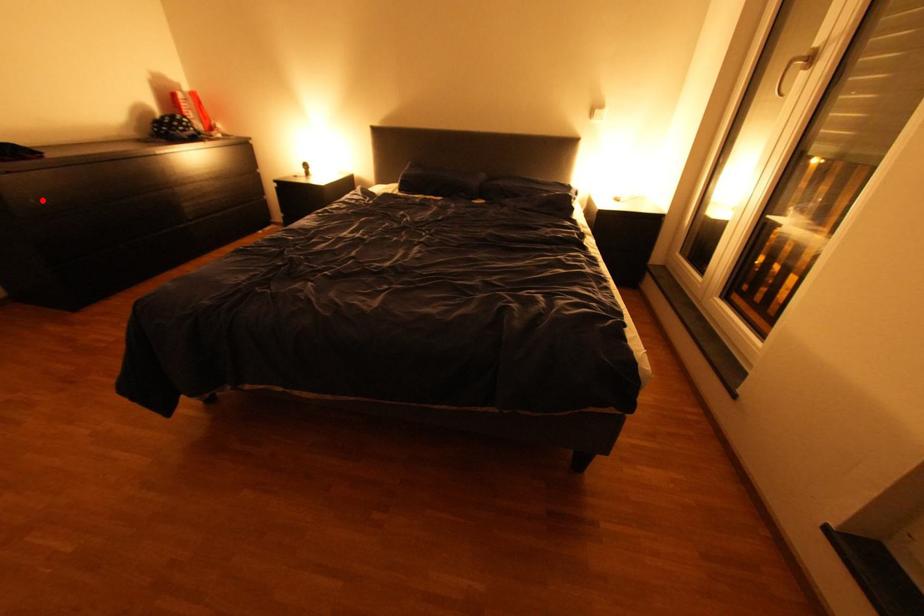
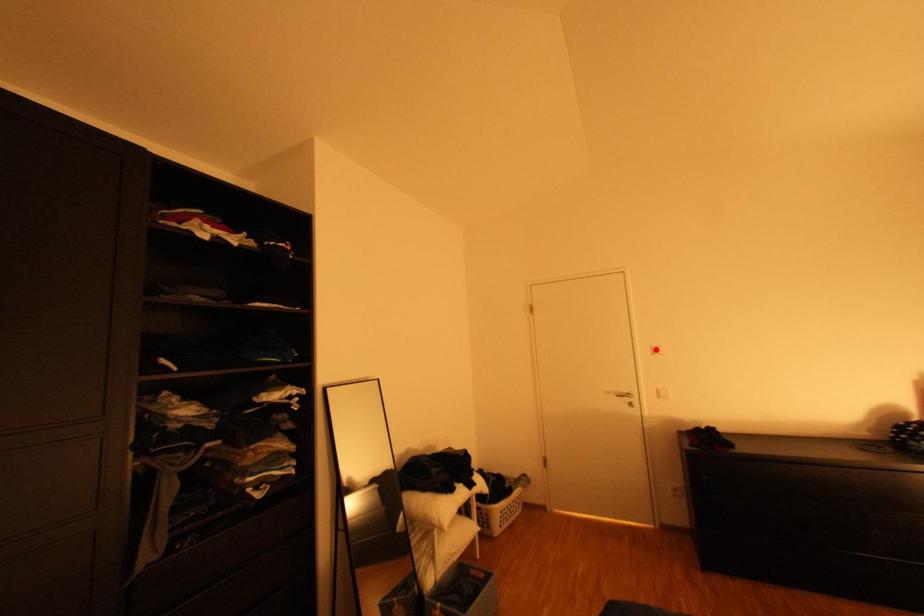
I am providing you with two images of the same scene from different viewpoints. A red point is marked on the first image and another point is marked on the second image. Is the red point in image1 aligned with the point shown in image2?

No